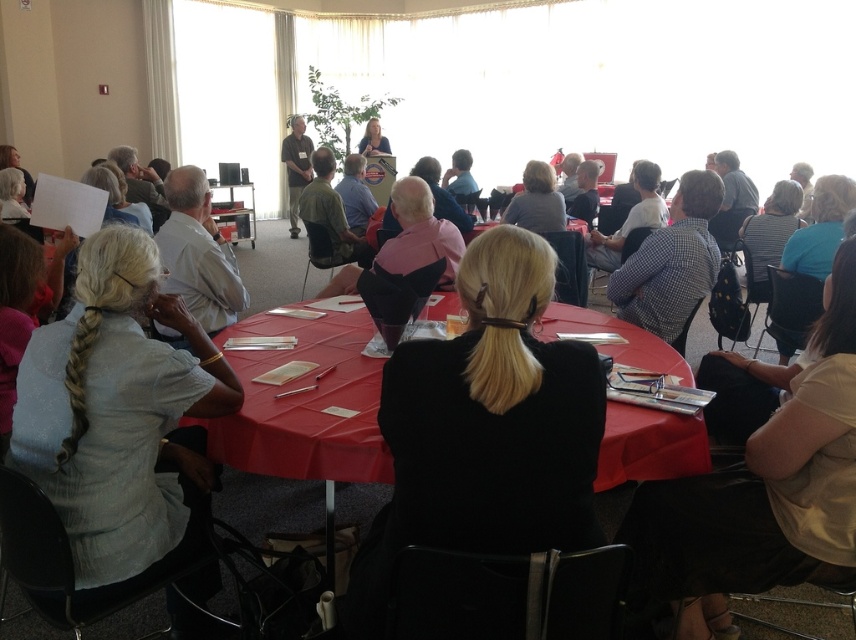
You are a photographer standing at the back of the conference room. You want to take a photo of the light blue fabric shirt at lower left and the red cloth table at center. Can you see both objects clearly in the photo without any obstruction?

The light blue fabric shirt at lower left is in front of the red cloth table at center, so the light blue fabric shirt at lower left may block the view of the red cloth table at center in the photo.

You are organizing a photo shoot and need to ensure that the blue checkered shirt at center and the matte white shirt at center are both visible in the frame. Based on their positions, which shirt should you focus on to capture both in the shot?

The blue checkered shirt at center is positioned over the matte white shirt at center, so focusing on the blue checkered shirt at center will ensure both are visible as it is in front.

From the picture: You are organizing a photo shoot in the conference room. You need to decide whether the light blue fabric shirt at lower left can be placed on the red cloth table at center without covering the entire surface. Can you confirm based on their sizes?

The light blue fabric shirt at lower left has a smaller size compared to red cloth table at center, so it can be placed on the table without covering the entire surface.